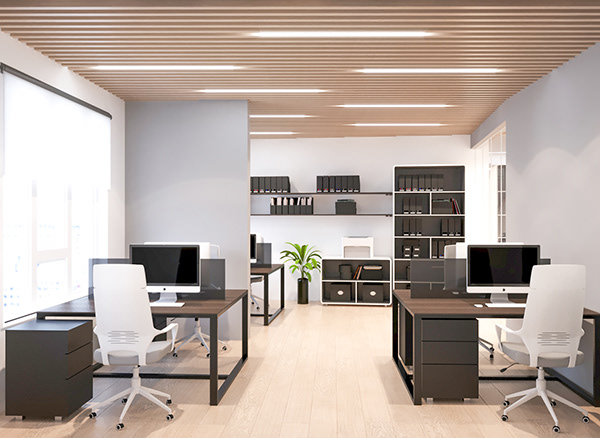
You are a GUI agent. You are given a task and a screenshot of the screen. Output one action in this format:
    pyautogui.click(x=<x>, y=<y>)
    Task: Click on the computer mouse
    This screenshot has height=438, width=600.
    Given the screenshot: What is the action you would take?
    pyautogui.click(x=477, y=306)